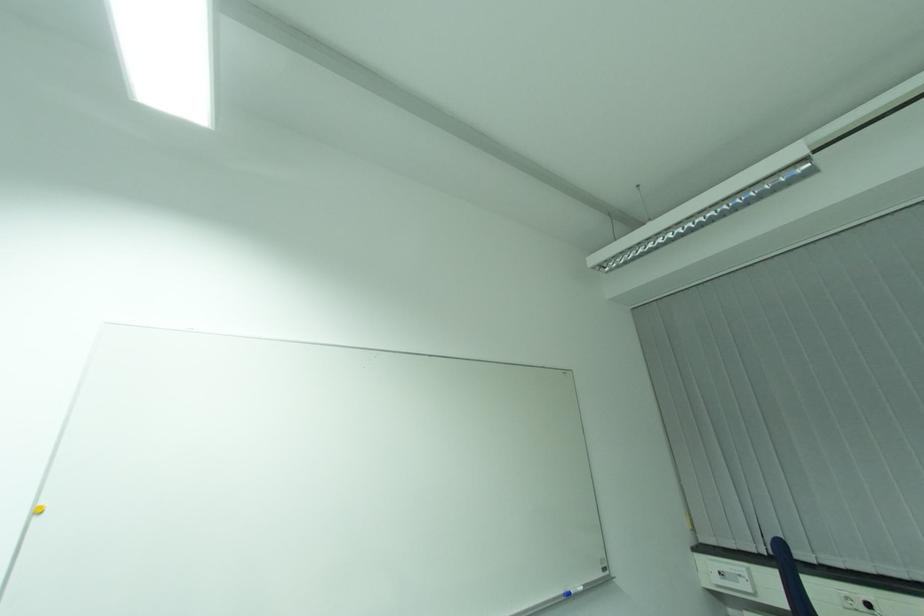
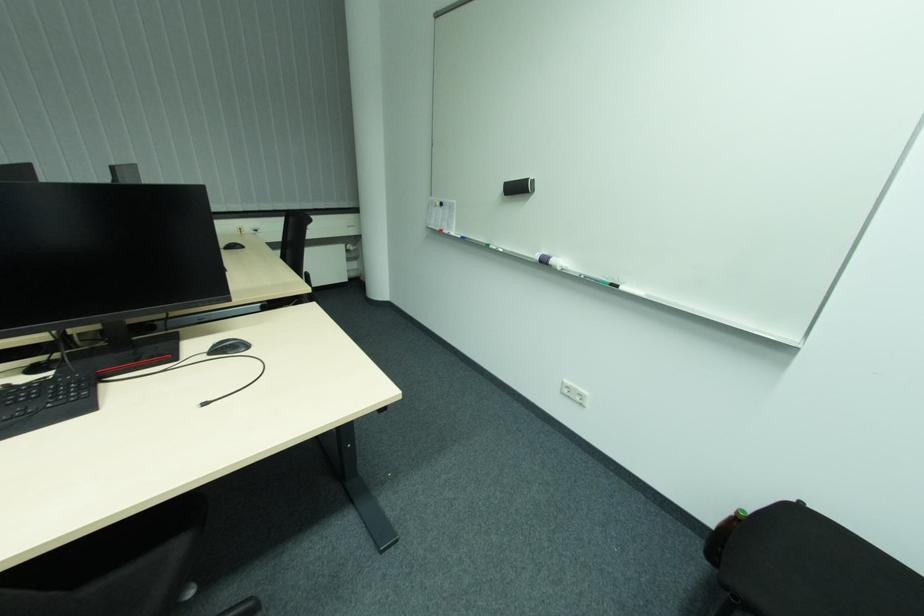
The first image is from the beginning of the video and the second image is from the end. How did the camera likely rotate when shooting the video?

The camera's rotation is toward right-down.